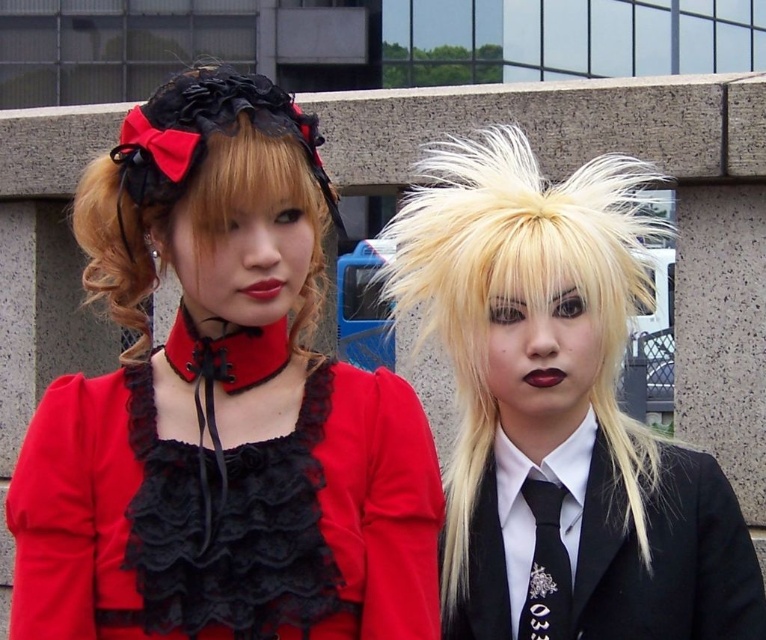
Question: Which of these objects is positioned farthest from the black lace dress at center?

Choices:
 (A) blonde feathered wig at right
 (B) black satin business suit at right

Answer: (B)

Question: Can you confirm if matte black dress at center is positioned below black satin tie at center?

Choices:
 (A) yes
 (B) no

Answer: (B)

Question: Where is black satin business suit at right located in relation to black satin tie at center in the image?

Choices:
 (A) right
 (B) left

Answer: (A)

Question: Can you confirm if blonde curly hair at left is wider than black satin business suit at right?

Choices:
 (A) yes
 (B) no

Answer: (B)

Question: Estimate the real-world distances between objects in this image. Which object is closer to the blonde feathered wig at right?

Choices:
 (A) black lace dress at center
 (B) matte black dress at center
 (C) black satin tie at center
 (D) black satin business suit at right

Answer: (D)

Question: Which point is closer to the camera?

Choices:
 (A) (277, 556)
 (B) (460, 324)
 (C) (529, 580)
 (D) (113, 234)

Answer: (A)